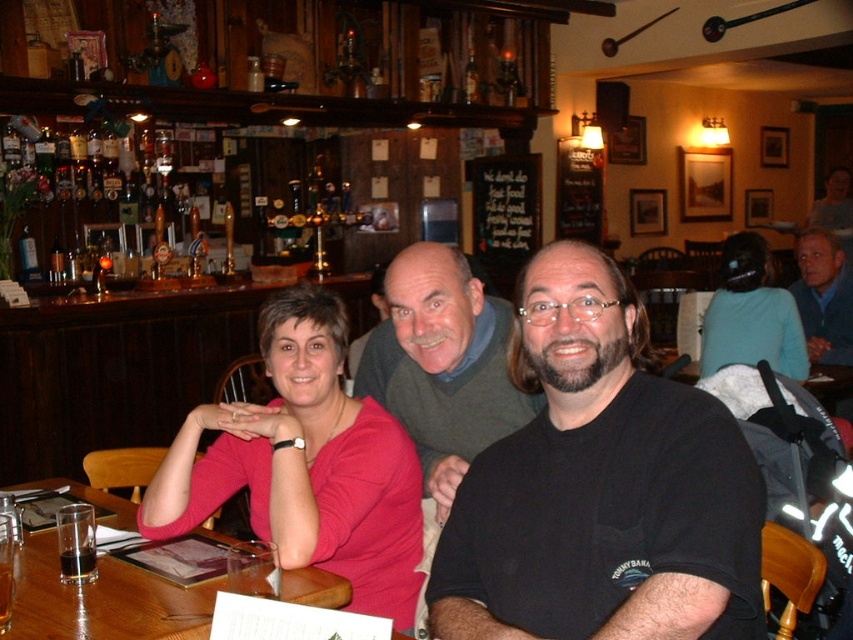
Who is more distant from viewer, (573,621) or (735,314)?

The point (735,314) is behind.

Between point (630, 456) and point (756, 262), which one is positioned in front?

Positioned in front is point (630, 456).

Who is more forward, (662, 460) or (758, 360)?

Point (662, 460) is in front.

Locate an element on the screen. This screenshot has width=853, height=640. black matte shirt at center is located at coordinates (601, 486).

Who is higher up, matte pink shirt at center or blue sweater at upper right?

blue sweater at upper right is higher up.

This screenshot has height=640, width=853. What are the coordinates of `matte pink shirt at center` in the screenshot? It's located at (305, 465).

Is point (289, 342) in front of point (809, 355)?

Yes.

Identify the location of matte pink shirt at center. (305, 465).

Measure the distance between green sweater at center and teal fabric shirt at upper right.

green sweater at center is 5.67 feet away from teal fabric shirt at upper right.

Does green sweater at center have a smaller size compared to teal fabric shirt at upper right?

Yes, green sweater at center is smaller than teal fabric shirt at upper right.

This screenshot has height=640, width=853. What are the coordinates of `green sweater at center` in the screenshot? It's located at (442, 364).